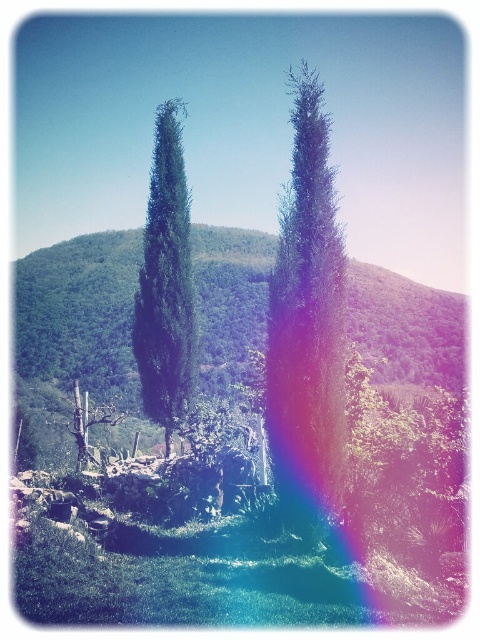
Can you confirm if green textured tree at center is positioned to the right of green matte tree at center?

Indeed, green textured tree at center is positioned on the right side of green matte tree at center.

Who is more distant from viewer, (320, 189) or (193, 352)?

The point (193, 352) is behind.

Where is `green textured tree at center`? The width and height of the screenshot is (480, 640). green textured tree at center is located at coordinates (307, 321).

Image resolution: width=480 pixels, height=640 pixels. What are the coordinates of `green textured tree at center` in the screenshot? It's located at (307, 321).